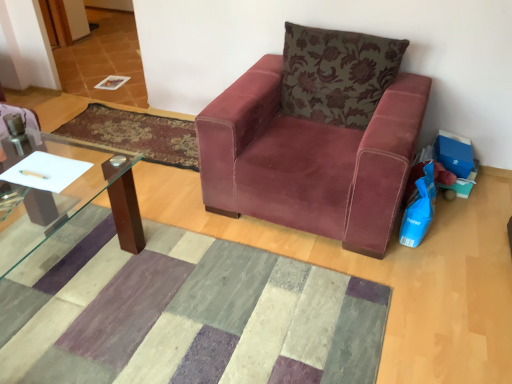
Identify the location of vacant area that lies in front of velvet maroon armchair at center. Image resolution: width=512 pixels, height=384 pixels. (308, 301).